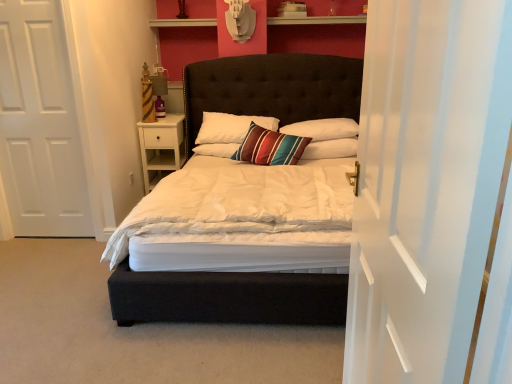
Question: From the image's perspective, does velvet dark brown bed at center appear higher than white sheer curtain at right?

Choices:
 (A) no
 (B) yes

Answer: (B)

Question: Considering the relative positions of velvet dark brown bed at center and white sheer curtain at right in the image provided, is velvet dark brown bed at center to the left of white sheer curtain at right from the viewer's perspective?

Choices:
 (A) no
 (B) yes

Answer: (B)

Question: Does velvet dark brown bed at center have a greater width compared to white sheer curtain at right?

Choices:
 (A) no
 (B) yes

Answer: (B)

Question: Is velvet dark brown bed at center in contact with white sheer curtain at right?

Choices:
 (A) yes
 (B) no

Answer: (B)

Question: From the image's perspective, would you say velvet dark brown bed at center is shown under white sheer curtain at right?

Choices:
 (A) yes
 (B) no

Answer: (B)

Question: From the image's perspective, is white sheer curtain at right located above or below white soft pillow at center, acting as the 1th pillow starting from the right?

Choices:
 (A) above
 (B) below

Answer: (B)

Question: In the image, is white sheer curtain at right positioned in front of or behind white soft pillow at center, acting as the 1th pillow starting from the right?

Choices:
 (A) front
 (B) behind

Answer: (A)

Question: Is white sheer curtain at right bigger or smaller than white soft pillow at center, acting as the 1th pillow starting from the right?

Choices:
 (A) big
 (B) small

Answer: (A)

Question: Choose the correct answer: Is white sheer curtain at right inside white soft pillow at center, acting as the 1th pillow starting from the right, or outside it?

Choices:
 (A) outside
 (B) inside

Answer: (A)

Question: Is white soft pillow at center, which is counted as the third pillow, starting from the left, taller or shorter than white matte door at left?

Choices:
 (A) short
 (B) tall

Answer: (A)

Question: Would you say white soft pillow at center, acting as the 1th pillow starting from the right, is inside or outside white matte door at left?

Choices:
 (A) outside
 (B) inside

Answer: (A)

Question: From the image's perspective, is white soft pillow at center, acting as the 1th pillow starting from the right, positioned above or below white matte door at left?

Choices:
 (A) above
 (B) below

Answer: (B)

Question: Is white soft pillow at center, acting as the 1th pillow starting from the right, wider or thinner than white matte door at left?

Choices:
 (A) wide
 (B) thin

Answer: (A)

Question: Is white soft pillow at center, acting as the 1th pillow starting from the right, in front of or behind striped fabric pillow at center, the 1th pillow when ordered from left to right, in the image?

Choices:
 (A) front
 (B) behind

Answer: (B)

Question: From the image's perspective, is white soft pillow at center, which is counted as the third pillow, starting from the left, above or below striped fabric pillow at center, the 1th pillow when ordered from left to right?

Choices:
 (A) below
 (B) above

Answer: (A)